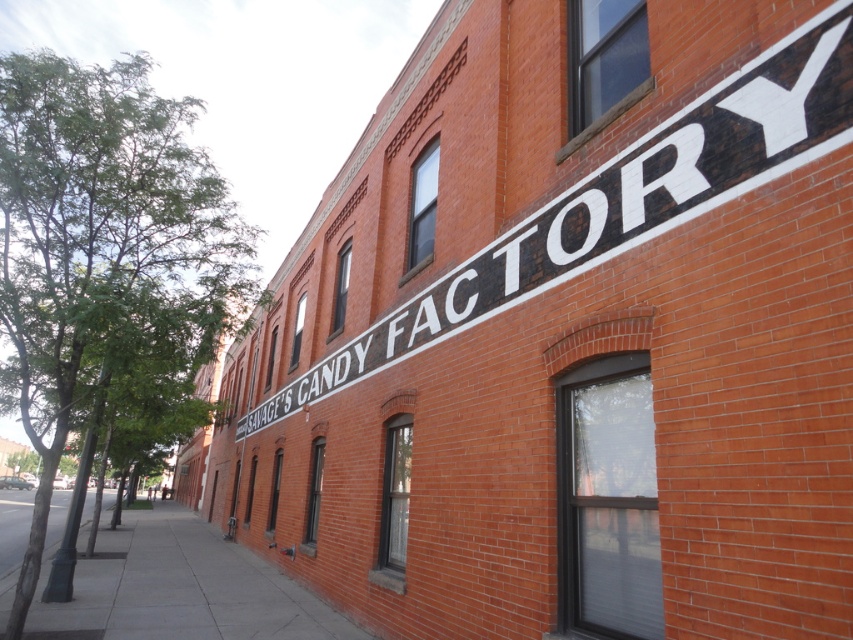
Based on the photo, you are a delivery person trying to locate the entrance to the Savage Candy Factory. You see the black painted sign at upper center and the gray concrete sidewalk at lower left. Which direction should you walk to reach the entrance from the sidewalk?

The black painted sign at upper center is positioned on the right side of the gray concrete sidewalk at lower left. Therefore, you should walk towards the right side of the gray concrete sidewalk at lower left to reach the entrance near the black painted sign at upper center.

You are standing on the sidewalk and looking at the building. Which object is nearer to you between the black painted sign at upper center and the gray concrete sidewalk at lower left?

The black painted sign at upper center is closer to the viewer than the gray concrete sidewalk at lower left.